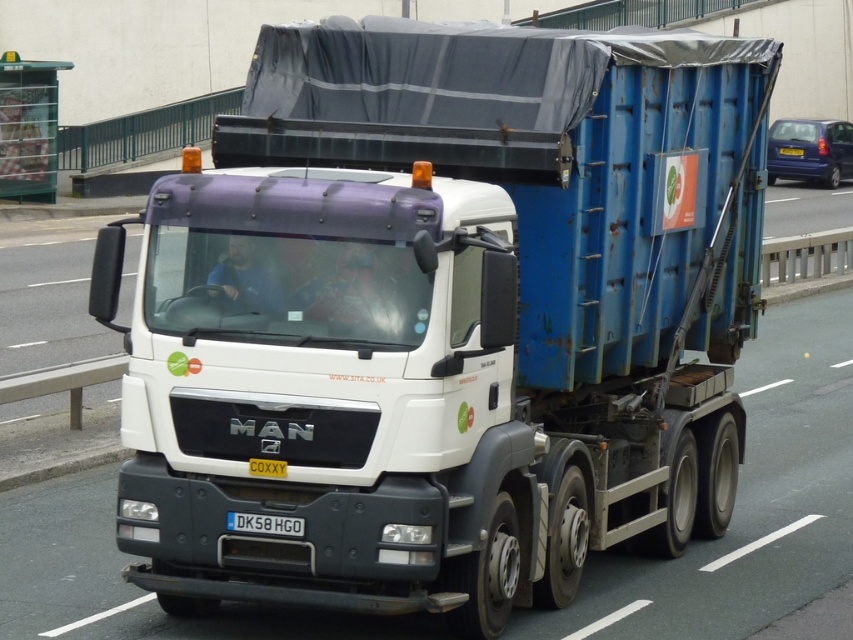
You are a photographer trying to capture the MAN refuse truck. You notice two points on the truck, one at point (x=250, y=465) and the other at point (x=796, y=148). Which point would appear larger in your photo?

Point (x=250, y=465) is closer to the camera than point (x=796, y=148), so it would appear larger in the photo.

You are a pedestrian standing at the point closest to the truck. Which of the two points, point (x=265, y=516) or point (x=248, y=465), is farther away from you?

Point (x=265, y=516) is farther away from you because it is behind point (x=248, y=465), which is closer to your position.

You are a traffic officer checking license plates. You notice two license plates on the truck, a white plastic license plate at center and a yellow metallic license plate at center. Which license plate is wider?

The white plastic license plate at center is thinner than the yellow metallic license plate at center, so the yellow metallic license plate at center is wider.